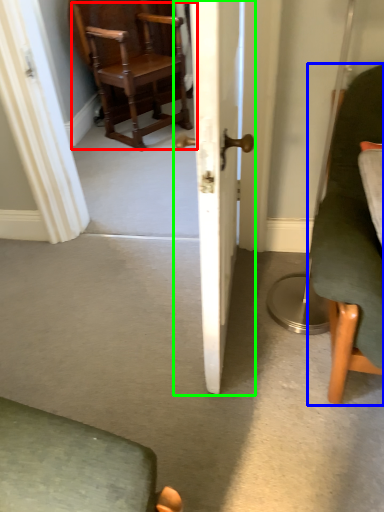
Question: Considering the real-world distances, which object is farthest from chair (highlighted by a red box)? chair (highlighted by a blue box) or door (highlighted by a green box)?

Choices:
 (A) chair
 (B) door

Answer: (A)